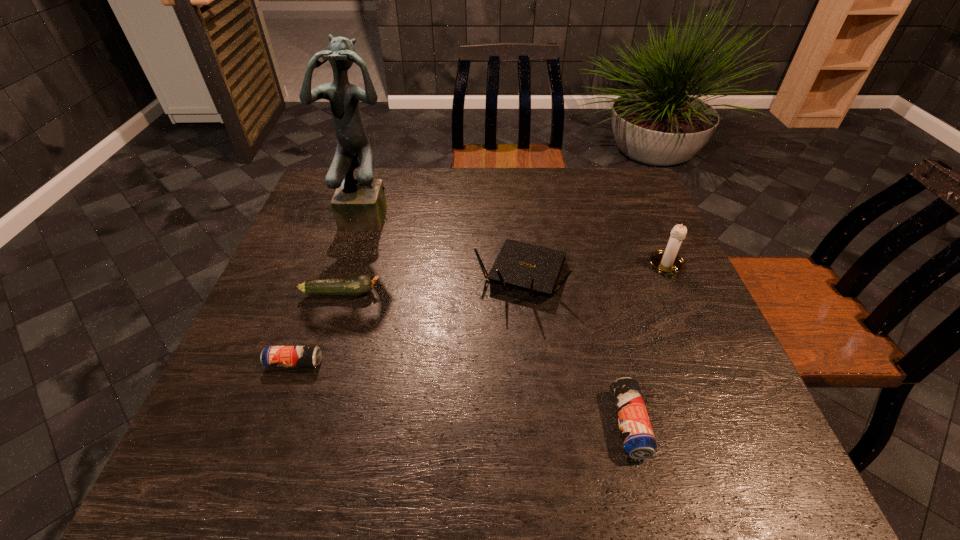
This screenshot has height=540, width=960. In order to click on zucchini in this screenshot , I will do `click(357, 285)`.

Find the location of a particular element. blank space located 0.200m on the right of the second nearest object is located at coordinates click(x=419, y=363).

Find the location of a particular element. The width and height of the screenshot is (960, 540). vacant region located on the left of the nearest object is located at coordinates (440, 424).

The width and height of the screenshot is (960, 540). Identify the location of free space located on the handle side of the fifth shortest object. (730, 407).

This screenshot has width=960, height=540. Identify the location of vacant space located 0.370m on the back of the router. (512, 172).

Find the location of a particular element. The width and height of the screenshot is (960, 540). vacant space located on the face of the farthest object is located at coordinates (361, 247).

Find the location of a particular element. The width and height of the screenshot is (960, 540). blank area located 0.170m at the blossom end of the zucchini is located at coordinates (452, 293).

This screenshot has height=540, width=960. In order to click on object at the far edge in this screenshot , I will do pyautogui.click(x=359, y=204).

In order to click on object located at the near edge in this screenshot , I will do `click(637, 435)`.

The height and width of the screenshot is (540, 960). What are the coordinates of `beer can situated at the left edge` in the screenshot? It's located at (273, 356).